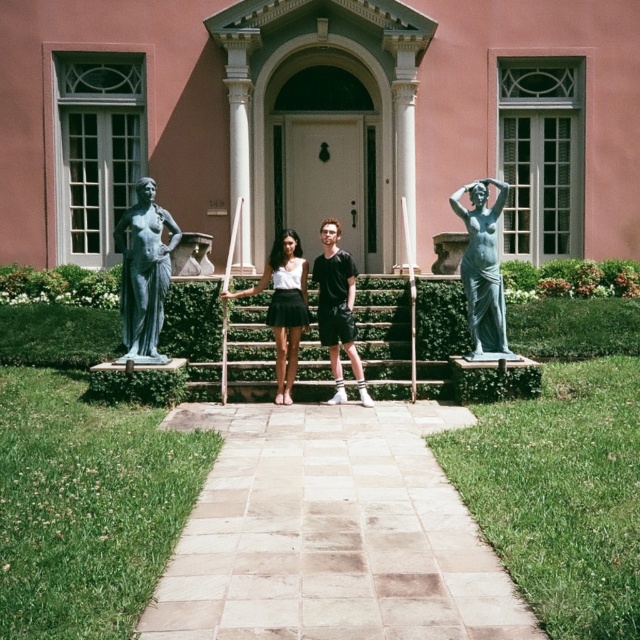
You are standing at the base of the wooden stairs at center and want to walk towards the matte green statue at right. Which direction should you move to reach it?

You should move to your right because the wooden stairs at center is to the left of the matte green statue at right, so moving right from the stairs will lead you toward the statue.

In the scene shown: You are standing in front of the grand pink building and notice the matte white blouse at center and the matte green statue at right. Which object is positioned more to the east side of the building?

The matte green statue at right is positioned more to the east side of the building because it is to the right of the matte white blouse at center.

You are a visitor standing at the bottom of the stone steps leading to the grand pink building. You want to take a photo of the matte white blouse at center without the matte green statue at right appearing in the frame. Is it possible to do so by moving closer to the blouse?

The matte green statue at right has a smaller size compared to matte white blouse at center. Moving closer to the matte white blouse at center may reduce the statue at right in the frame, but since the statue is smaller, it might still be visible depending on the camera angle and distance. However, the description does not provide information about their spatial arrangement or distance, so it is uncertain if moving closer would fully exclude the statue from the frame.